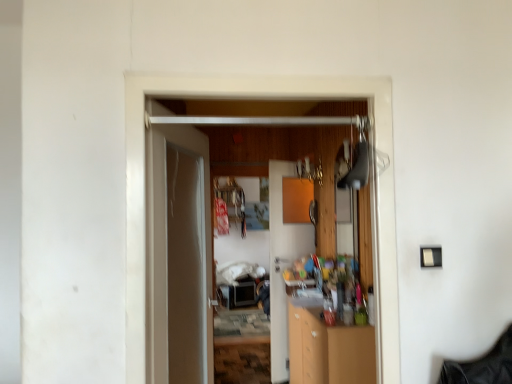
How much space does white glossy door at center, which ranks as the second door in back-to-front order, occupy horizontally?

white glossy door at center, which ranks as the second door in back-to-front order, is 5.42 inches wide.

Where is `wooden cabinet at center`? wooden cabinet at center is located at coordinates (329, 350).

What are the coordinates of `white glossy door at center, which ranks as the second door in back-to-front order` in the screenshot? It's located at (180, 255).

Is white glossy door at center, the second door in the front-to-back sequence, to the left or to the right of wooden cabinet at center in the image?

white glossy door at center, the second door in the front-to-back sequence, is to the left of wooden cabinet at center.

How many degrees apart are the facing directions of white glossy door at center, the second door in the front-to-back sequence, and wooden cabinet at center?

The angle between the facing direction of white glossy door at center, the second door in the front-to-back sequence, and the facing direction of wooden cabinet at center is 162 degrees.

Looking at the image, does white glossy door at center, which ranks as the second door in back-to-front order, seem bigger or smaller compared to wooden cabinet at center?

white glossy door at center, which ranks as the second door in back-to-front order, is smaller than wooden cabinet at center.

Considering the sizes of objects white glossy door at center, the second door in the front-to-back sequence, and wooden cabinet at center in the image provided, who is thinner, white glossy door at center, the second door in the front-to-back sequence, or wooden cabinet at center?

white glossy door at center, the second door in the front-to-back sequence.

Considering the relative positions of wooden cabinet at center, which appears as the first door when viewed from the back, and white glossy door at center, the second door in the front-to-back sequence, in the image provided, is wooden cabinet at center, which appears as the first door when viewed from the back, in front of white glossy door at center, the second door in the front-to-back sequence,?

No, wooden cabinet at center, which appears as the first door when viewed from the back, is behind white glossy door at center, the second door in the front-to-back sequence.

In the scene shown: Is the surface of wooden cabinet at center, which appears as the first door when viewed from the back, in direct contact with white glossy door at center, which ranks as the second door in back-to-front order?

wooden cabinet at center, which appears as the first door when viewed from the back, is not next to white glossy door at center, which ranks as the second door in back-to-front order, and they're not touching.

Which of these two, wooden cabinet at center, which appears as the first door when viewed from the back, or white glossy door at center, which ranks as the second door in back-to-front order, stands shorter?

With less height is white glossy door at center, which ranks as the second door in back-to-front order.

From the image's perspective, is wooden cabinet at center, the 3th door from the front, below white glossy door at center, the second door in the front-to-back sequence?

Indeed, from the image's perspective, wooden cabinet at center, the 3th door from the front, is shown beneath white glossy door at center, the second door in the front-to-back sequence.

Does wooden cabinet at center, which appears as the first door when viewed from the back, appear on the right side of wooden cabinet at center?

In fact, wooden cabinet at center, which appears as the first door when viewed from the back, is to the left of wooden cabinet at center.

Is wooden cabinet at center, which appears as the first door when viewed from the back, not inside wooden cabinet at center?

Yes.

Is wooden cabinet at center, the 3th door from the front, in front of or behind wooden cabinet at center in the image?

wooden cabinet at center, the 3th door from the front, is behind wooden cabinet at center.

Find the location of a particular element. This screenshot has height=384, width=512. the 1st door counting from the left of the wooden cabinet at center, the 3th door from the front is located at coordinates (154, 196).

Is the depth of wooden cabinet at center, which appears as the first door when viewed from the back, less than that of wooden door at center, arranged as the 1th door when viewed from the front?

No, it is behind wooden door at center, arranged as the 1th door when viewed from the front.

From a real-world perspective, is wooden cabinet at center, which appears as the first door when viewed from the back, on wooden door at center, marked as the 3th door in a back-to-front arrangement?

Actually, wooden cabinet at center, which appears as the first door when viewed from the back, is physically below wooden door at center, marked as the 3th door in a back-to-front arrangement, in the real world.

Is wooden cabinet at center, the 3th door from the front, at the left side of wooden door at center, marked as the 3th door in a back-to-front arrangement?

No, wooden cabinet at center, the 3th door from the front, is not to the left of wooden door at center, marked as the 3th door in a back-to-front arrangement.

Would you say wooden door at center, arranged as the 1th door when viewed from the front, is to the left or to the right of white glossy door at center, which ranks as the second door in back-to-front order, in the picture?

Clearly, wooden door at center, arranged as the 1th door when viewed from the front, is on the right of white glossy door at center, which ranks as the second door in back-to-front order, in the image.

How distant is wooden door at center, marked as the 3th door in a back-to-front arrangement, from white glossy door at center, the second door in the front-to-back sequence?

wooden door at center, marked as the 3th door in a back-to-front arrangement, is 12.86 inches away from white glossy door at center, the second door in the front-to-back sequence.

Consider the image. From the image's perspective, is wooden door at center, marked as the 3th door in a back-to-front arrangement, over white glossy door at center, the second door in the front-to-back sequence?

Yes.

Is wooden door at center, marked as the 3th door in a back-to-front arrangement, next to white glossy door at center, which ranks as the second door in back-to-front order?

No, wooden door at center, marked as the 3th door in a back-to-front arrangement, is not making contact with white glossy door at center, which ranks as the second door in back-to-front order.

Which is closer, [149,304] or [373,357]?

Point [149,304] appears to be closer to the viewer than point [373,357].

From a real-world perspective, is wooden door at center, marked as the 3th door in a back-to-front arrangement, on top of wooden cabinet at center?

Correct, in the physical world, wooden door at center, marked as the 3th door in a back-to-front arrangement, is higher than wooden cabinet at center.

Does wooden door at center, arranged as the 1th door when viewed from the front, appear on the right side of wooden cabinet at center?

In fact, wooden door at center, arranged as the 1th door when viewed from the front, is to the left of wooden cabinet at center.

Is wooden cabinet at center located within wooden door at center, marked as the 3th door in a back-to-front arrangement?

No, wooden cabinet at center is not surrounded by wooden door at center, marked as the 3th door in a back-to-front arrangement.

Is wooden door at center, arranged as the 1th door when viewed from the front, wider than wooden cabinet at center, which appears as the first door when viewed from the back?

Incorrect, the width of wooden door at center, arranged as the 1th door when viewed from the front, does not surpass that of wooden cabinet at center, which appears as the first door when viewed from the back.

Is wooden door at center, arranged as the 1th door when viewed from the front, aimed at wooden cabinet at center, which appears as the first door when viewed from the back?

→ No.

Consider the image. From the image's perspective, which one is positioned higher, wooden door at center, marked as the 3th door in a back-to-front arrangement, or wooden cabinet at center, which appears as the first door when viewed from the back?

wooden door at center, marked as the 3th door in a back-to-front arrangement.

You are a GUI agent. You are given a task and a screenshot of the screen. Output one action in this format:
    pyautogui.click(x=<x>, y=<y>)
    Task: Click on the 3rd door to the left when counting from the wooden cabinet at center
    This screenshot has width=512, height=384.
    Given the screenshot: What is the action you would take?
    pyautogui.click(x=180, y=255)

Locate an element on the screen. The image size is (512, 384). door below the white glossy door at center, which ranks as the second door in back-to-front order (from a real-world perspective) is located at coordinates point(282,264).

When comparing their distances from wooden door at center, marked as the 3th door in a back-to-front arrangement, does wooden cabinet at center, the 3th door from the front, or wooden cabinet at center seem closer?

The object closer to wooden door at center, marked as the 3th door in a back-to-front arrangement, is wooden cabinet at center.

Based on their spatial positions, is wooden cabinet at center, which appears as the first door when viewed from the back, or white glossy door at center, which ranks as the second door in back-to-front order, closer to wooden cabinet at center?

wooden cabinet at center, which appears as the first door when viewed from the back, is positioned closer to the anchor wooden cabinet at center.

Which object lies nearer to the anchor point wooden cabinet at center, white glossy door at center, the second door in the front-to-back sequence, or wooden cabinet at center, the 3th door from the front?

Based on the image, wooden cabinet at center, the 3th door from the front, appears to be nearer to wooden cabinet at center.

Based on their spatial positions, is wooden cabinet at center or white glossy door at center, the second door in the front-to-back sequence, further from wooden cabinet at center, which appears as the first door when viewed from the back?

white glossy door at center, the second door in the front-to-back sequence.

From the image, which object appears to be farther from wooden door at center, marked as the 3th door in a back-to-front arrangement, wooden cabinet at center or white glossy door at center, which ranks as the second door in back-to-front order?

wooden cabinet at center is further to wooden door at center, marked as the 3th door in a back-to-front arrangement.

Considering their positions, is white glossy door at center, which ranks as the second door in back-to-front order, positioned closer to wooden cabinet at center, which appears as the first door when viewed from the back, than wooden door at center, marked as the 3th door in a back-to-front arrangement?

Among the two, white glossy door at center, which ranks as the second door in back-to-front order, is located nearer to wooden cabinet at center, which appears as the first door when viewed from the back.

Looking at the image, which one is located further to wooden cabinet at center, which appears as the first door when viewed from the back, wooden door at center, arranged as the 1th door when viewed from the front, or wooden cabinet at center?

Based on the image, wooden door at center, arranged as the 1th door when viewed from the front, appears to be further to wooden cabinet at center, which appears as the first door when viewed from the back.

When comparing their distances from wooden door at center, arranged as the 1th door when viewed from the front, does white glossy door at center, the second door in the front-to-back sequence, or wooden cabinet at center, which appears as the first door when viewed from the back, seem further?

wooden cabinet at center, which appears as the first door when viewed from the back.

The height and width of the screenshot is (384, 512). Identify the location of cabinetry between white glossy door at center, which ranks as the second door in back-to-front order, and wooden cabinet at center, the 3th door from the front, along the z-axis. (329, 350).

In order to click on cabinetry between wooden door at center, marked as the 3th door in a back-to-front arrangement, and wooden cabinet at center, which appears as the first door when viewed from the back, in the front-back direction in this screenshot , I will do `click(329, 350)`.

Identify the location of door positioned between wooden door at center, arranged as the 1th door when viewed from the front, and wooden cabinet at center from near to far. The width and height of the screenshot is (512, 384). (180, 255).

I want to click on door between wooden door at center, marked as the 3th door in a back-to-front arrangement, and wooden cabinet at center, the 3th door from the front, along the z-axis, so click(x=180, y=255).